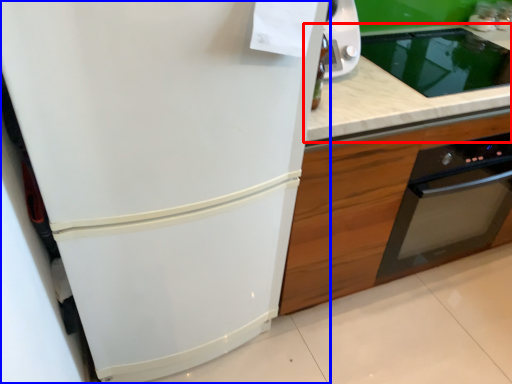
Question: Which object is further to the camera taking this photo, countertop (highlighted by a red box) or refrigerator (highlighted by a blue box)?

Choices:
 (A) countertop
 (B) refrigerator

Answer: (A)